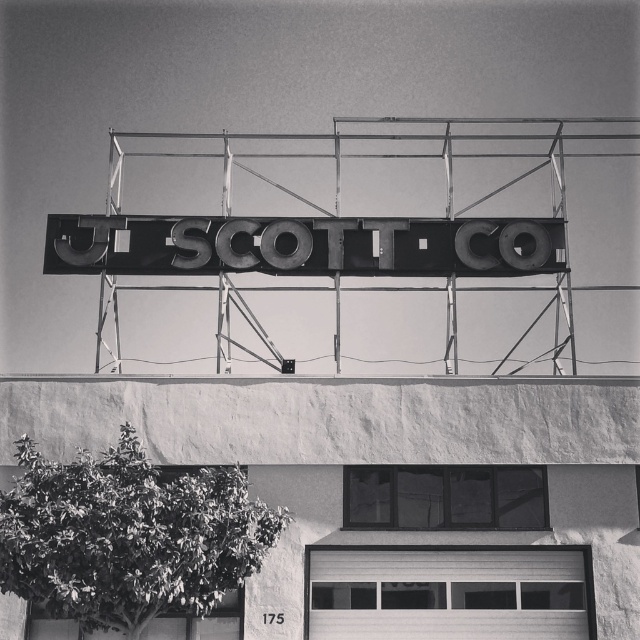
Does point (531, 259) lie behind point (324, 588)?

Yes, point (531, 259) is behind point (324, 588).

Which is behind, point (304, 237) or point (340, 580)?

The point (304, 237) is more distant.

What do you see at coordinates (301, 244) in the screenshot?
I see `metallic letters at center` at bounding box center [301, 244].

The image size is (640, 640). What are the coordinates of `metallic letters at center` in the screenshot? It's located at (301, 244).